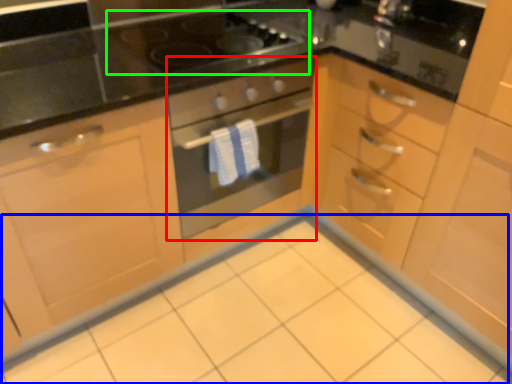
Question: Estimate the real-world distances between objects in this image. Which object is closer to oven (highlighted by a red box), ceramic tile (highlighted by a blue box) or gas stove (highlighted by a green box)?

Choices:
 (A) ceramic tile
 (B) gas stove

Answer: (B)